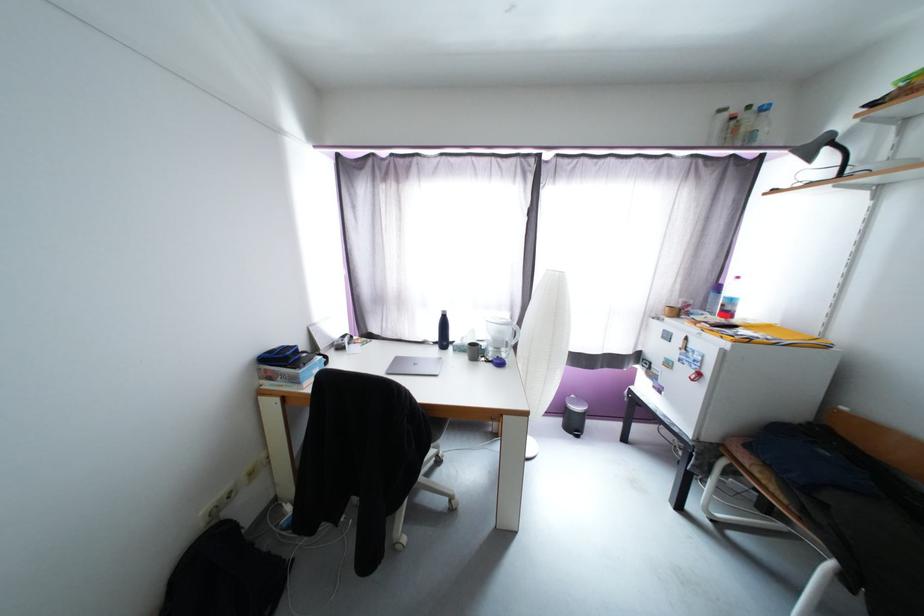
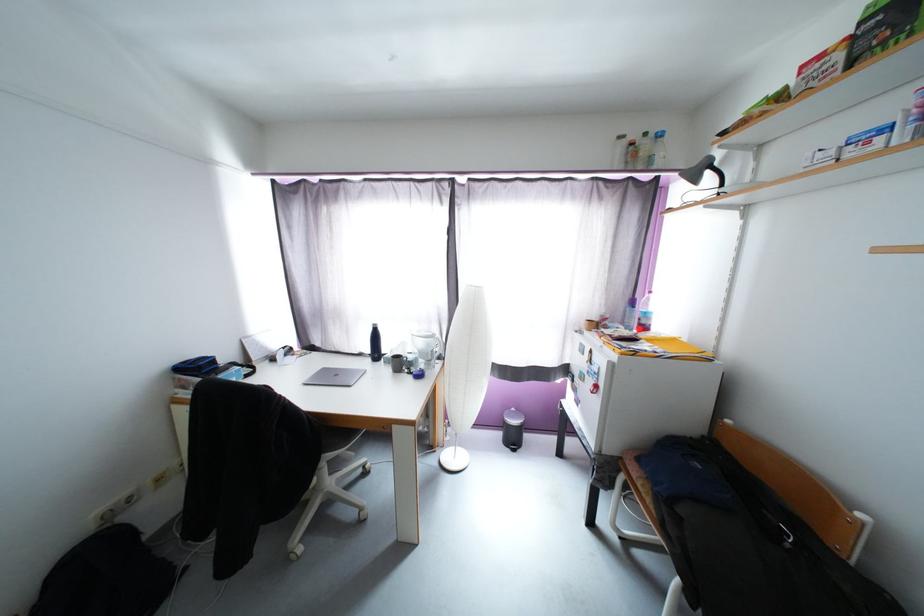
Locate, in the second image, the point that corresponds to pixel 738 120 in the first image.

(638, 146)